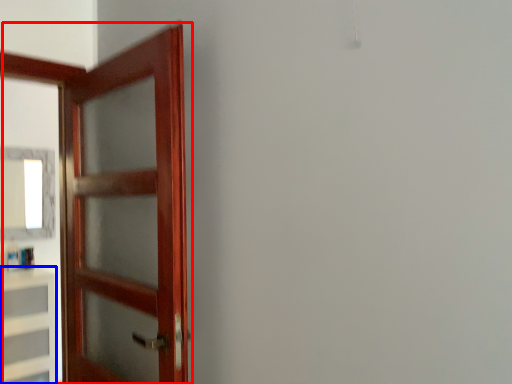
Question: Among these objects, which one is nearest to the camera, door (highlighted by a red box) or cabinetry (highlighted by a blue box)?

Choices:
 (A) door
 (B) cabinetry

Answer: (A)